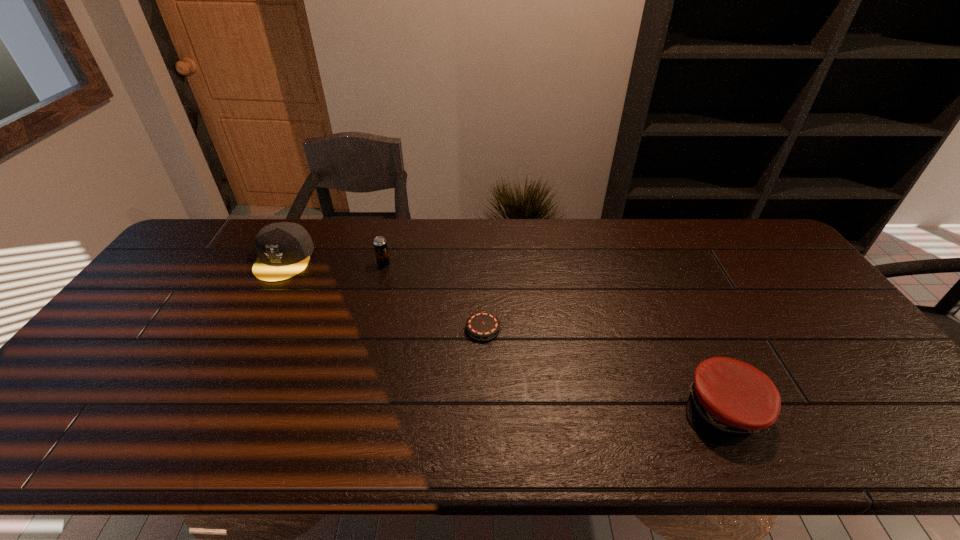
Select which object appears as the closest to the nearest object. Please provide its 2D coordinates. Your answer should be formatted as a tuple, i.e. [(x, y)], where the tuple contains the x and y coordinates of a point satisfying the conditions above.

[(481, 326)]

At what (x,y) coordinates should I click in order to perform the action: click on vacant area in the image that satisfies the following two spatial constraints: 1. on the front-facing side of the farther cap; 2. on the left side of the chocolate cake. Please return your answer as a coordinate pair (x, y). The image size is (960, 540). Looking at the image, I should click on (247, 329).

Find the location of a particular element. vacant space that satisfies the following two spatial constraints: 1. on the front-facing side of the farther cap; 2. on the left side of the second object from right to left is located at coordinates (247, 329).

Where is `vacant position in the image that satisfies the following two spatial constraints: 1. on the front-facing side of the beer can; 2. on the left side of the leftmost object`? vacant position in the image that satisfies the following two spatial constraints: 1. on the front-facing side of the beer can; 2. on the left side of the leftmost object is located at coordinates (281, 264).

Where is `free point that satisfies the following two spatial constraints: 1. on the front-facing side of the shortest object; 2. on the left side of the farther cap`? This screenshot has height=540, width=960. free point that satisfies the following two spatial constraints: 1. on the front-facing side of the shortest object; 2. on the left side of the farther cap is located at coordinates (247, 329).

Identify the location of free region that satisfies the following two spatial constraints: 1. on the front-facing side of the third object from right to left; 2. on the left side of the left cap. Image resolution: width=960 pixels, height=540 pixels. (281, 264).